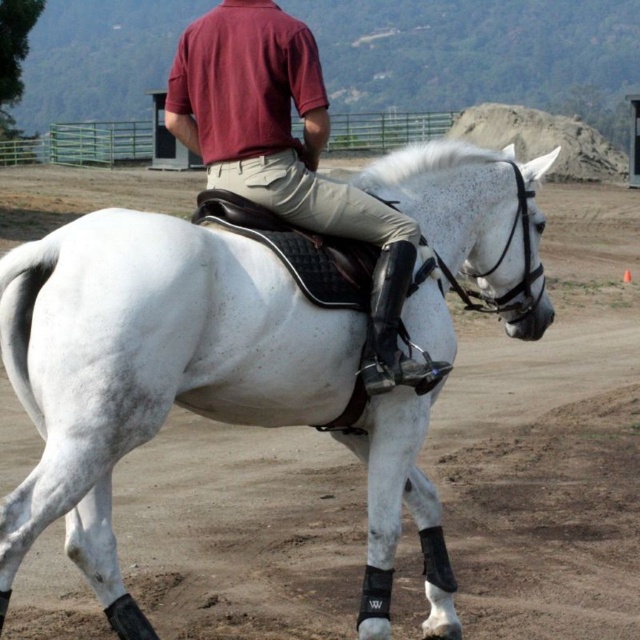
Question: Observing the image, what is the correct spatial positioning of white matte/suede horse at center in reference to matte red polo shirt at upper center?

Choices:
 (A) left
 (B) right

Answer: (A)

Question: Which object is farther from the camera taking this photo?

Choices:
 (A) white matte/suede horse at center
 (B) matte red polo shirt at upper center

Answer: (B)

Question: Is white matte/suede horse at center thinner than matte red polo shirt at upper center?

Choices:
 (A) no
 (B) yes

Answer: (A)

Question: Is white matte/suede horse at center to the left of matte red polo shirt at upper center from the viewer's perspective?

Choices:
 (A) yes
 (B) no

Answer: (A)

Question: Among these objects, which one is farthest from the camera?

Choices:
 (A) matte red polo shirt at upper center
 (B) white matte/suede horse at center

Answer: (A)